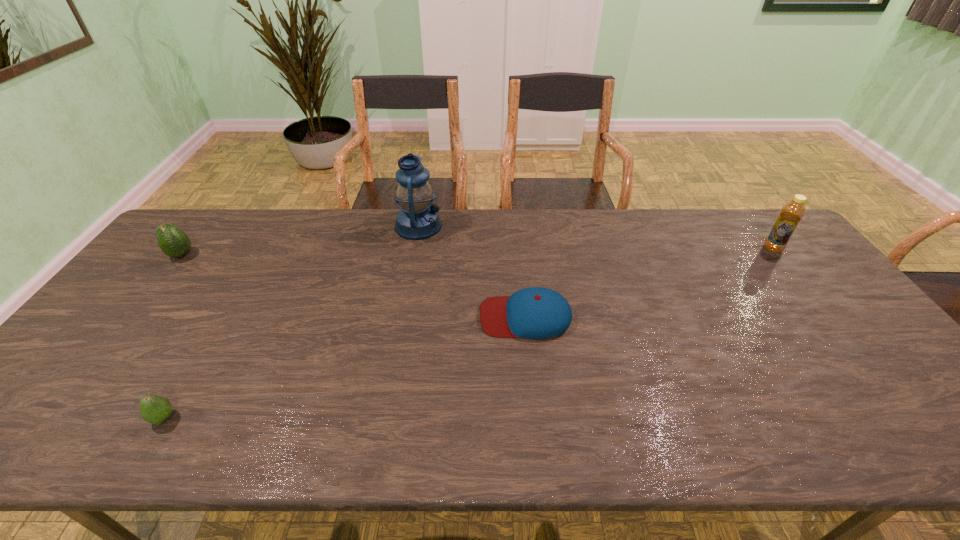
Where is `vacant area between the second object from right to left and the second tallest object`? vacant area between the second object from right to left and the second tallest object is located at coordinates click(649, 282).

You are a GUI agent. You are given a task and a screenshot of the screen. Output one action in this format:
    pyautogui.click(x=<x>, y=<y>)
    Task: Click on the vacant point located between the fourth object from left to right and the right avocado
    The height and width of the screenshot is (540, 960).
    Given the screenshot: What is the action you would take?
    pyautogui.click(x=345, y=367)

The height and width of the screenshot is (540, 960). I want to click on empty space between the left avocado and the tallest object, so click(x=300, y=241).

Identify the location of free space between the tallest object and the fourth farthest object. (472, 271).

At what (x,y) coordinates should I click in order to perform the action: click on free point between the rightmost object and the lantern. Please return your answer as a coordinate pair (x, y). The width and height of the screenshot is (960, 540). Looking at the image, I should click on (595, 238).

Locate an element on the screen. This screenshot has width=960, height=540. unoccupied position between the right avocado and the leftmost object is located at coordinates (173, 337).

Where is `vacant space in between the baseball cap and the bottle`? The height and width of the screenshot is (540, 960). vacant space in between the baseball cap and the bottle is located at coordinates (649, 282).

At what (x,y) coordinates should I click in order to perform the action: click on free space between the tallest object and the rightmost object. Please return your answer as a coordinate pair (x, y). Looking at the image, I should click on (595, 238).

Where is `vacant space that is in between the second object from left to right and the third object from right to left`? Image resolution: width=960 pixels, height=540 pixels. vacant space that is in between the second object from left to right and the third object from right to left is located at coordinates (291, 322).

Point out which object is positioned as the nearest to the farther avocado. Please provide its 2D coordinates. Your answer should be formatted as a tuple, i.e. [(x, y)], where the tuple contains the x and y coordinates of a point satisfying the conditions above.

[(155, 409)]